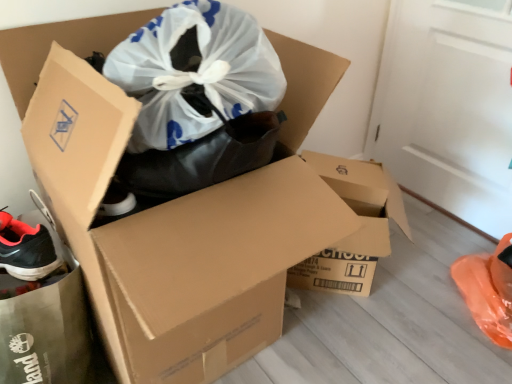
Question: From the image's perspective, does brown cardboard box at center, the second box in the left-to-right sequence, appear lower than brown cardboard box at center, positioned as the second box in right-to-left order?

Choices:
 (A) no
 (B) yes

Answer: (B)

Question: Can you confirm if brown cardboard box at center, the second box in the left-to-right sequence, is positioned to the left of brown cardboard box at center, positioned as the first box in left-to-right order?

Choices:
 (A) no
 (B) yes

Answer: (A)

Question: Is the position of brown cardboard box at center, the second box in the left-to-right sequence, more distant than that of brown cardboard box at center, positioned as the second box in right-to-left order?

Choices:
 (A) yes
 (B) no

Answer: (A)

Question: From the image's perspective, does brown cardboard box at center, the second box in the left-to-right sequence, appear higher than brown cardboard box at center, positioned as the first box in left-to-right order?

Choices:
 (A) no
 (B) yes

Answer: (A)

Question: From a real-world perspective, is brown cardboard box at center, the 1th box viewed from the right, physically above brown cardboard box at center, positioned as the first box in left-to-right order?

Choices:
 (A) yes
 (B) no

Answer: (B)

Question: Are brown cardboard box at center, the second box in the left-to-right sequence, and brown cardboard box at center, positioned as the second box in right-to-left order, far apart?

Choices:
 (A) no
 (B) yes

Answer: (A)

Question: Is brown cardboard box at center, positioned as the first box in left-to-right order, wider than brown cardboard box at center, the 1th box viewed from the right?

Choices:
 (A) yes
 (B) no

Answer: (A)

Question: Is brown cardboard box at center, the second box in the left-to-right sequence, inside brown cardboard box at center, positioned as the first box in left-to-right order?

Choices:
 (A) yes
 (B) no

Answer: (B)

Question: Is brown cardboard box at center, positioned as the second box in right-to-left order, shorter than brown cardboard box at center, the 1th box viewed from the right?

Choices:
 (A) no
 (B) yes

Answer: (A)

Question: From the image's perspective, is brown cardboard box at center, positioned as the second box in right-to-left order, beneath brown cardboard box at center, the second box in the left-to-right sequence?

Choices:
 (A) yes
 (B) no

Answer: (B)

Question: Is brown cardboard box at center, positioned as the second box in right-to-left order, not inside brown cardboard box at center, the second box in the left-to-right sequence?

Choices:
 (A) yes
 (B) no

Answer: (A)

Question: Is brown cardboard box at center, positioned as the second box in right-to-left order, further to the viewer compared to brown cardboard box at center, the second box in the left-to-right sequence?

Choices:
 (A) yes
 (B) no

Answer: (B)

Question: From a real-world perspective, is black matte shoe at lower left on brown cardboard box at center, the 1th box viewed from the right?

Choices:
 (A) no
 (B) yes

Answer: (B)